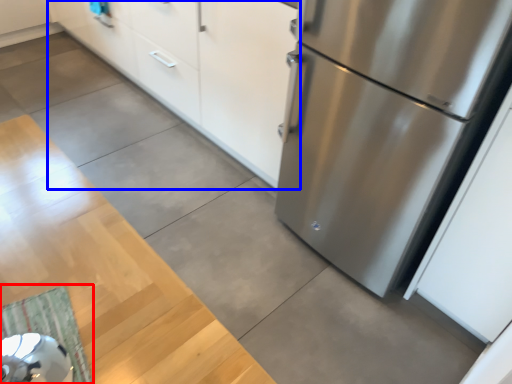
Question: Among these objects, which one is farthest to the camera, doormat (highlighted by a red box) or cabinetry (highlighted by a blue box)?

Choices:
 (A) doormat
 (B) cabinetry

Answer: (B)